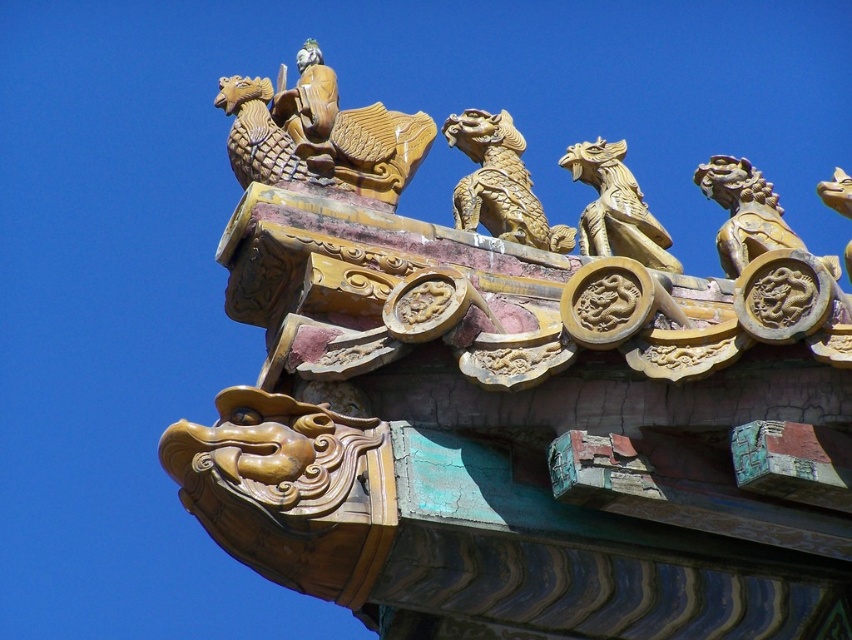
Is gold textured dragon at upper center taller than gold carved dragon at center?

Yes.

Looking at this image, does gold textured dragon at upper center have a lesser height compared to gold carved dragon at center?

In fact, gold textured dragon at upper center may be taller than gold carved dragon at center.

Between point (453, 211) and point (574, 161), which one is positioned behind?

Positioned behind is point (574, 161).

Locate an element on the screen. Image resolution: width=852 pixels, height=640 pixels. gold textured dragon at upper center is located at coordinates (499, 182).

Does gold/gilded dragon at upper center appear on the right side of gold carved dragon at center?

In fact, gold/gilded dragon at upper center is to the left of gold carved dragon at center.

Between gold/gilded dragon at upper center and gold carved dragon at center, which one appears on the right side from the viewer's perspective?

From the viewer's perspective, gold carved dragon at center appears more on the right side.

The height and width of the screenshot is (640, 852). Describe the element at coordinates (320, 132) in the screenshot. I see `gold/gilded dragon at upper center` at that location.

I want to click on gold/gilded dragon at upper center, so click(x=320, y=132).

Between point (292, 129) and point (504, 180), which one is positioned in front?

Point (292, 129) is in front.

Between gold/gilded dragon at upper center and gold textured dragon at upper center, which one is positioned lower?

gold textured dragon at upper center is below.

Is point (399, 193) positioned after point (492, 122)?

No, (399, 193) is in front of (492, 122).

Identify the location of gold/gilded dragon at upper center. (320, 132).